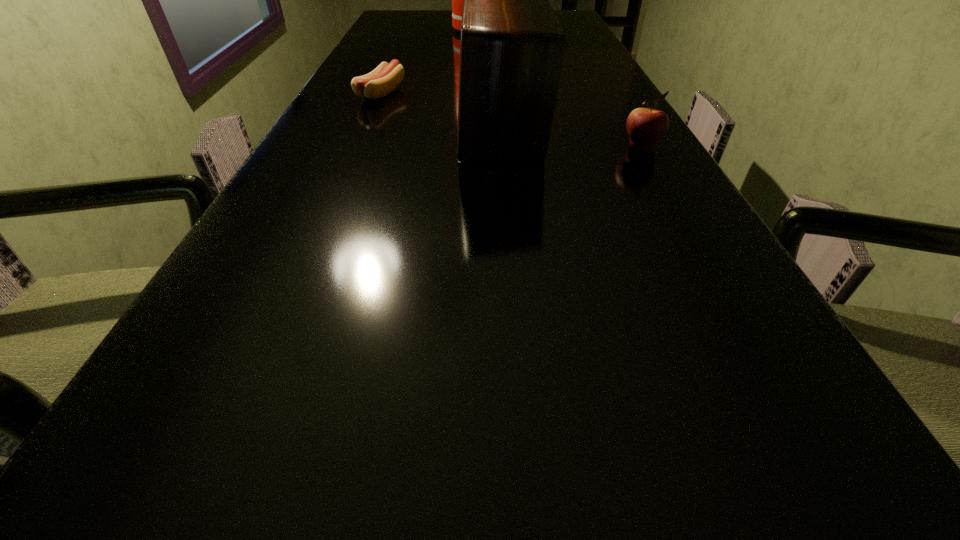
Identify the location of the farthest object. This screenshot has height=540, width=960. [457, 0].

Find the location of a particular element. This screenshot has height=540, width=960. fire extinguisher is located at coordinates (457, 0).

Locate an element on the screen. The image size is (960, 540). the second tallest object is located at coordinates (512, 46).

The height and width of the screenshot is (540, 960). Identify the location of the second shortest object. (645, 126).

You are a GUI agent. You are given a task and a screenshot of the screen. Output one action in this format:
    pyautogui.click(x=<x>, y=<y>)
    Task: Click on the rightmost object
    This screenshot has width=960, height=540.
    Given the screenshot: What is the action you would take?
    pyautogui.click(x=645, y=126)

Where is `the leftmost object`? This screenshot has height=540, width=960. the leftmost object is located at coordinates click(x=380, y=82).

Locate an element on the screen. the shortest object is located at coordinates (380, 82).

What are the coordinates of `vacant space situated at the nozzle of the tallest object` in the screenshot? It's located at (470, 66).

Image resolution: width=960 pixels, height=540 pixels. Find the location of `vacant point located on the front-facing side of the third shortest object`. vacant point located on the front-facing side of the third shortest object is located at coordinates (350, 123).

Where is `free space located 0.130m on the front-facing side of the third shortest object`? The height and width of the screenshot is (540, 960). free space located 0.130m on the front-facing side of the third shortest object is located at coordinates (403, 123).